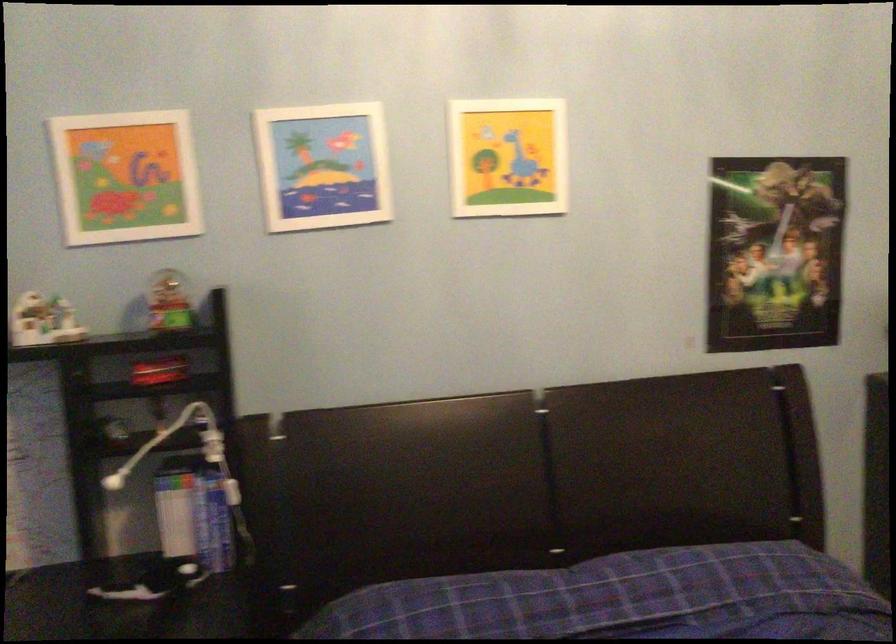
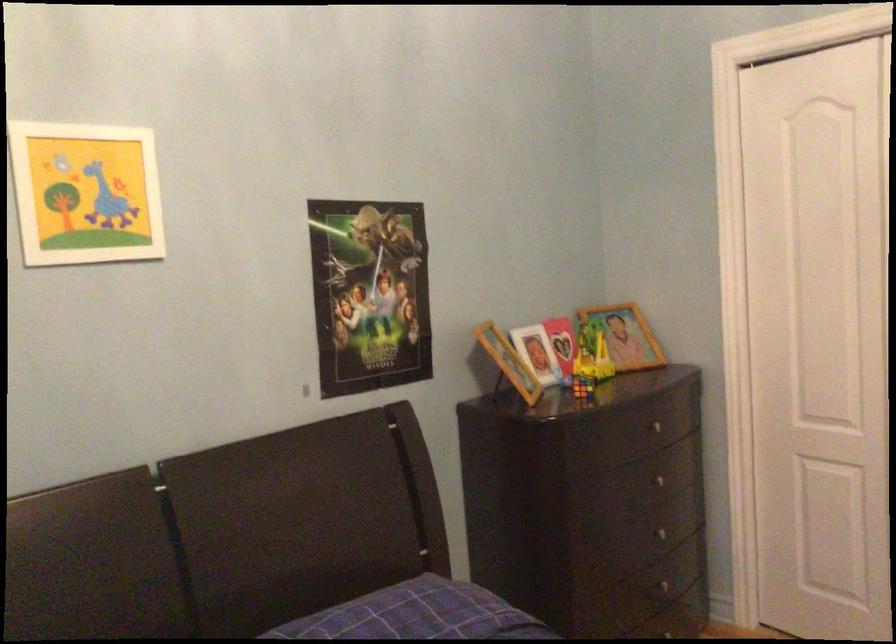
Where in the second image is the point corresponding to the point at 773,254 from the first image?

(369, 294)